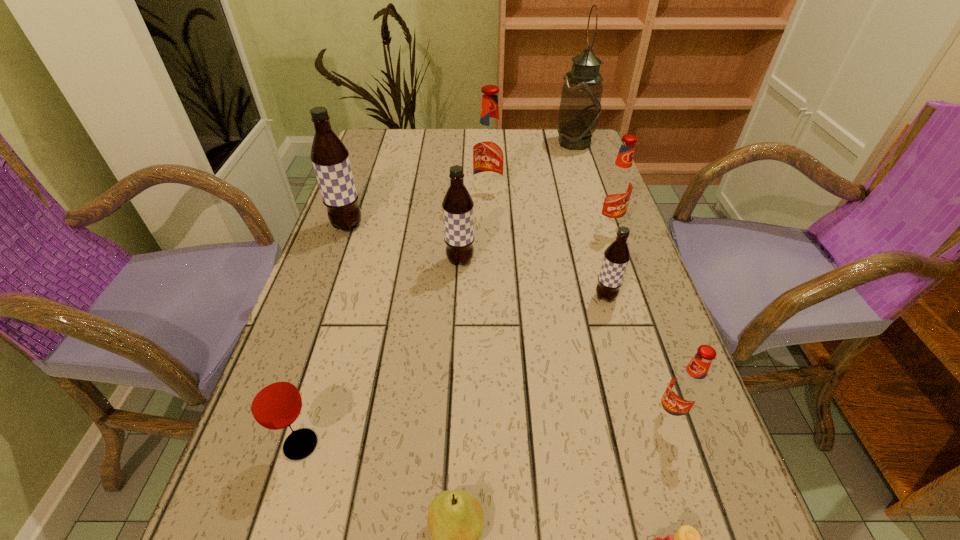
The width and height of the screenshot is (960, 540). What are the coordinates of `free spot between the farthest red root beer and the smallest red root beer` in the screenshot? It's located at (580, 307).

Locate an element on the screen. The width and height of the screenshot is (960, 540). unoccupied area between the red glass and the leftmost root beer is located at coordinates (324, 335).

Where is `empty space between the sixth nearest object and the second biggest red root beer`? The height and width of the screenshot is (540, 960). empty space between the sixth nearest object and the second biggest red root beer is located at coordinates (535, 243).

Where is `vacant point located between the red glass and the smallest brown root beer`? This screenshot has height=540, width=960. vacant point located between the red glass and the smallest brown root beer is located at coordinates pos(453,371).

You are a GUI agent. You are given a task and a screenshot of the screen. Output one action in this format:
    pyautogui.click(x=<x>, y=<y>)
    Task: Click on the vacant point located between the second farthest red root beer and the smallest red root beer
    Image resolution: width=960 pixels, height=540 pixels.
    Given the screenshot: What is the action you would take?
    pyautogui.click(x=639, y=321)

The width and height of the screenshot is (960, 540). I want to click on vacant area that lies between the glass and the nearest red root beer, so click(486, 430).

Identify the location of free spot between the red glass and the leftmost red root beer. The height and width of the screenshot is (540, 960). (395, 322).

Locate which object ranks second in proximity to the pear. Please provide its 2D coordinates. Your answer should be formatted as a tuple, i.e. [(x, y)], where the tuple contains the x and y coordinates of a point satisfying the conditions above.

[(686, 539)]

The width and height of the screenshot is (960, 540). I want to click on the fifth closest object to the nearest red root beer, so click(x=618, y=185).

Where is `root beer that is the fifth closest to the rightmost brown root beer`? root beer that is the fifth closest to the rightmost brown root beer is located at coordinates (330, 158).